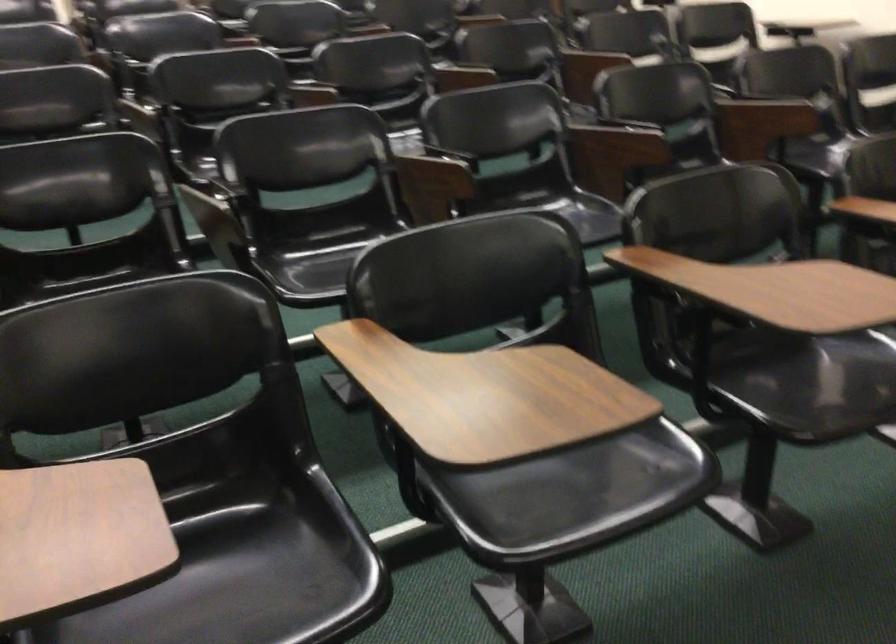
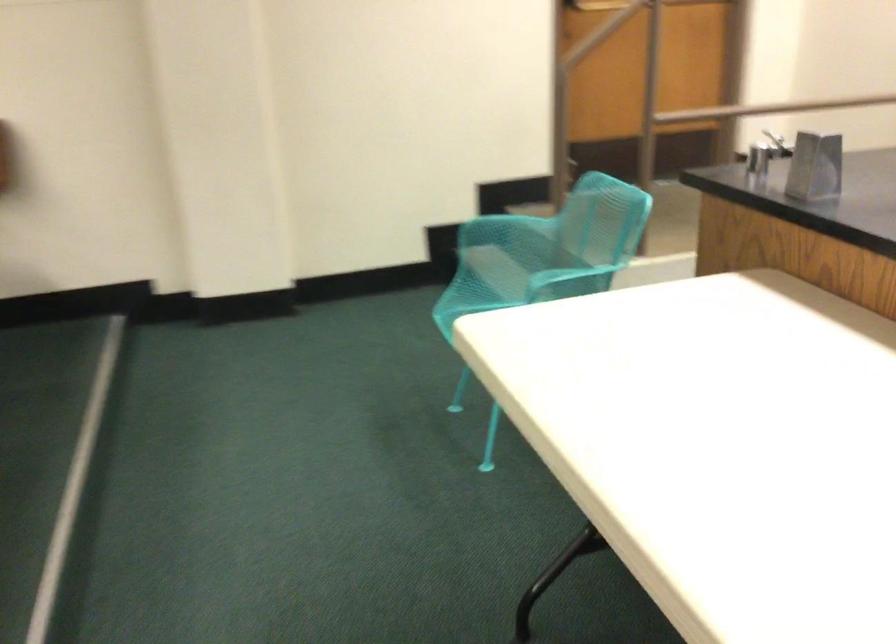
Question: Based on the continuous images, in which direction is the camera rotating? Reply with the corresponding letter.

Choices:
 (A) Left
 (B) Right
 (C) Up
 (D) Down

Answer: (B)